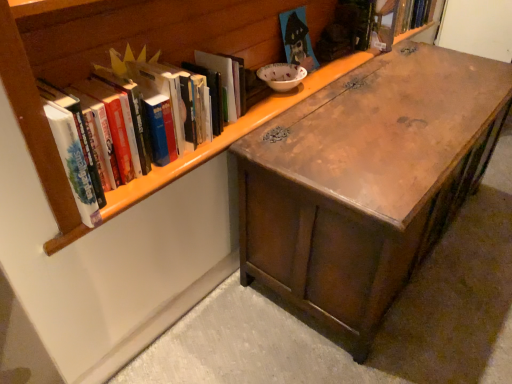
Question: From the image's perspective, is wooden chest at center on top of white matte book at upper left, which appears as the 3th book when viewed from the right?

Choices:
 (A) yes
 (B) no

Answer: (B)

Question: Does wooden chest at center appear on the right side of white matte book at upper left, which is the first book from front to back?

Choices:
 (A) no
 (B) yes

Answer: (B)

Question: Is wooden chest at center closer to the viewer compared to white matte book at upper left, which appears as the 3th book when viewed from the right?

Choices:
 (A) no
 (B) yes

Answer: (A)

Question: Does wooden chest at center contain white matte book at upper left, marked as the third book in a top-to-bottom arrangement?

Choices:
 (A) yes
 (B) no

Answer: (B)

Question: Is wooden chest at center shorter than white matte book at upper left, the third book when ordered from back to front?

Choices:
 (A) yes
 (B) no

Answer: (B)

Question: Relative to wooden house-shaped book at upper center, acting as the second book starting from the front, is white matte book at upper left, the first book when ordered from left to right, in front or behind?

Choices:
 (A) behind
 (B) front

Answer: (B)

Question: Visually, is white matte book at upper left, the third book when ordered from back to front, positioned to the left or to the right of wooden house-shaped book at upper center, acting as the second book starting from the front?

Choices:
 (A) right
 (B) left

Answer: (B)

Question: In terms of height, does white matte book at upper left, which is the first book from front to back, look taller or shorter compared to wooden house-shaped book at upper center, which is counted as the 2th book, starting from the top?

Choices:
 (A) tall
 (B) short

Answer: (A)

Question: Looking at the image, does white matte book at upper left, which appears as the 3th book when viewed from the right, seem bigger or smaller compared to wooden house-shaped book at upper center, which is the second book from back to front?

Choices:
 (A) small
 (B) big

Answer: (B)

Question: From the image's perspective, is hardcover book at upper right, positioned as the 3th book in front-to-back order, located above or below wooden bookshelf at upper left?

Choices:
 (A) below
 (B) above

Answer: (B)

Question: From a real-world perspective, is hardcover book at upper right, which ranks as the 1th book in top-to-bottom order, above or below wooden bookshelf at upper left?

Choices:
 (A) below
 (B) above

Answer: (A)

Question: In the image, is hardcover book at upper right, the 1th book viewed from the right, positioned in front of or behind wooden bookshelf at upper left?

Choices:
 (A) behind
 (B) front

Answer: (A)

Question: Looking at the image, does hardcover book at upper right, the 3th book from the left, seem bigger or smaller compared to wooden bookshelf at upper left?

Choices:
 (A) small
 (B) big

Answer: (A)

Question: In terms of height, does wooden bookshelf at upper left look taller or shorter compared to hardcover book at upper right, the 3th book from the bottom?

Choices:
 (A) short
 (B) tall

Answer: (B)

Question: Is wooden bookshelf at upper left inside the boundaries of hardcover book at upper right, the 1th book viewed from the right, or outside?

Choices:
 (A) outside
 (B) inside

Answer: (A)